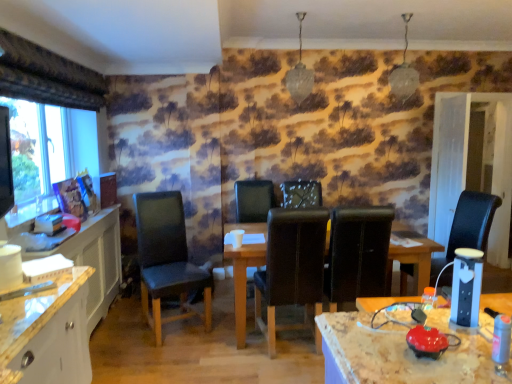
The height and width of the screenshot is (384, 512). I want to click on vacant space underneath dark blue leather chair at center, which ranks as the 1th chair in left-to-right order (from a real-world perspective), so click(x=179, y=324).